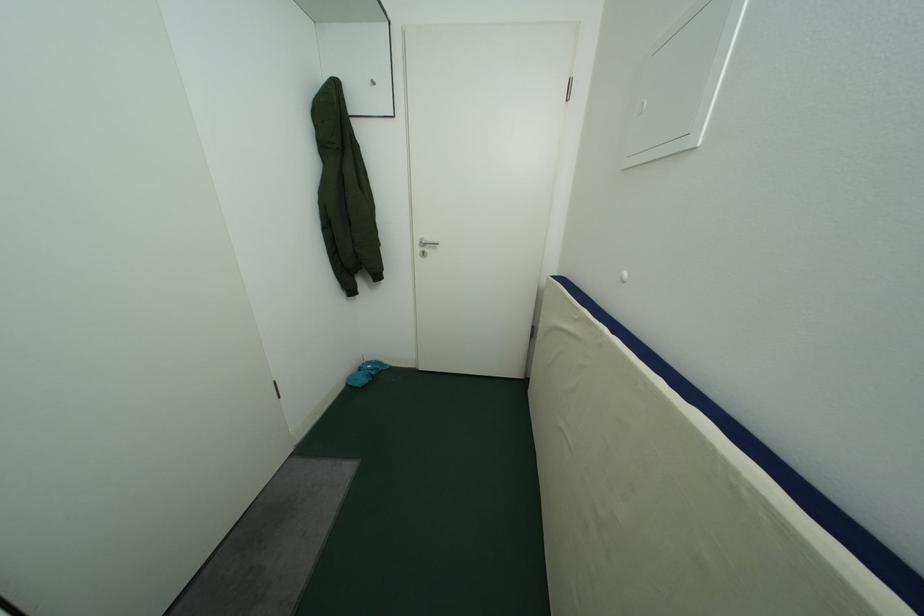
Describe the element at coordinates (428, 241) in the screenshot. I see `a metal door handle` at that location.